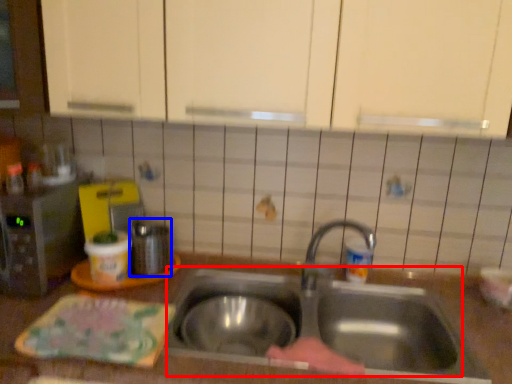
Question: Among these objects, which one is farthest to the camera, sink (highlighted by a red box) or appliance (highlighted by a blue box)?

Choices:
 (A) sink
 (B) appliance

Answer: (B)